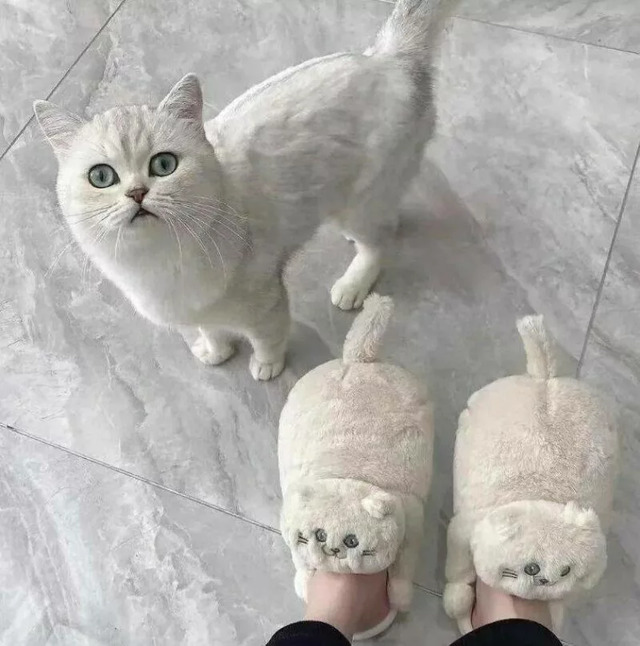
This screenshot has width=640, height=646. Find the location of `white marble floor`. white marble floor is located at coordinates (589, 241).